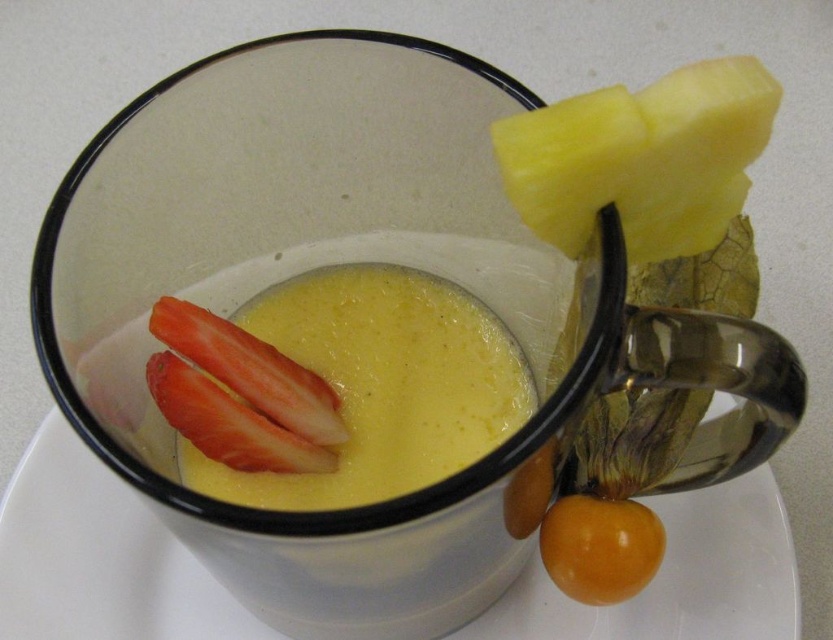
Question: Which point is closer to the camera taking this photo?

Choices:
 (A) (222, 404)
 (B) (602, 582)
 (C) (581, 160)

Answer: (C)

Question: Which of the following is the closest to the observer?

Choices:
 (A) (153, 396)
 (B) (527, 221)

Answer: (B)

Question: Which point is closer to the camera taking this photo?

Choices:
 (A) (253, 426)
 (B) (627, 204)
 (C) (562, 513)

Answer: (B)

Question: Does yellow smooth pineapple at upper right have a lesser width compared to orange glossy physalis at lower right?

Choices:
 (A) yes
 (B) no

Answer: (B)

Question: Is orange glossy physalis at lower right above red matte strawberry at lower left?

Choices:
 (A) no
 (B) yes

Answer: (A)

Question: Does yellow smooth pineapple at upper right have a greater width compared to orange glossy physalis at lower right?

Choices:
 (A) yes
 (B) no

Answer: (A)